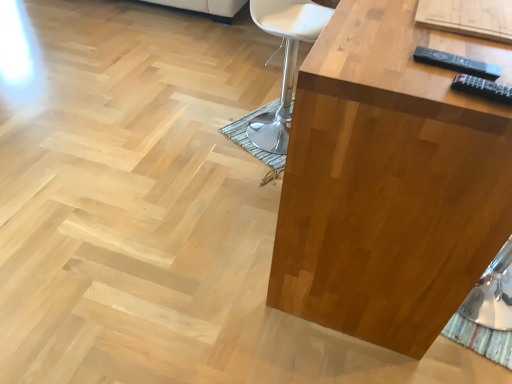
Find the location of a particular element. free area in between black plastic remote at upper right, the 2th remote viewed from the back, and black plastic remote at upper right, the 1th remote positioned from the back is located at coordinates (452, 80).